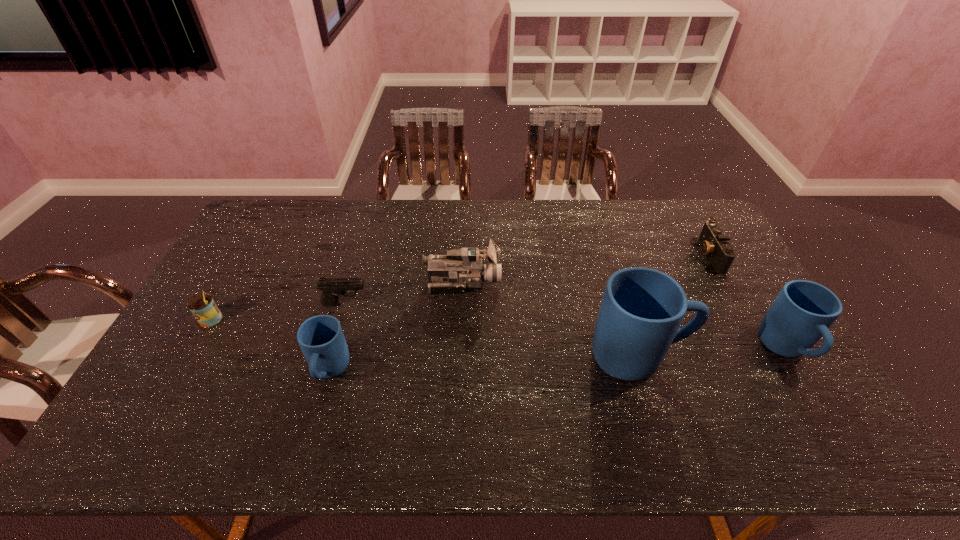
This screenshot has height=540, width=960. Find the location of `the leftmost mug`. the leftmost mug is located at coordinates (321, 339).

The width and height of the screenshot is (960, 540). Identify the location of the tallest mug. (642, 309).

What are the coordinates of `the second mug from right to left` in the screenshot? It's located at (642, 309).

This screenshot has width=960, height=540. What are the coordinates of `the rightmost mug` in the screenshot? It's located at (803, 311).

Locate an element on the screen. Image resolution: width=960 pixels, height=540 pixels. camcorder is located at coordinates (462, 268).

Locate an element on the screen. the leftmost object is located at coordinates (204, 309).

You are a GUI agent. You are given a task and a screenshot of the screen. Output one action in this format:
    pyautogui.click(x=<x>, y=<y>)
    Task: Click on the shortest object
    The height and width of the screenshot is (540, 960).
    Given the screenshot: What is the action you would take?
    pyautogui.click(x=714, y=244)

Identify the location of the fifth nearest object. This screenshot has width=960, height=540. (332, 287).

The height and width of the screenshot is (540, 960). Find the location of `free location located on the side of the second mug from right to left with the handle`. free location located on the side of the second mug from right to left with the handle is located at coordinates (756, 356).

You are a GUI agent. You are given a task and a screenshot of the screen. Output one action in this format:
    pyautogui.click(x=<x>, y=<y>)
    Task: Click on the free space located 0.050m on the side of the second tallest mug with the handle
    
    Given the screenshot: What is the action you would take?
    pyautogui.click(x=814, y=395)